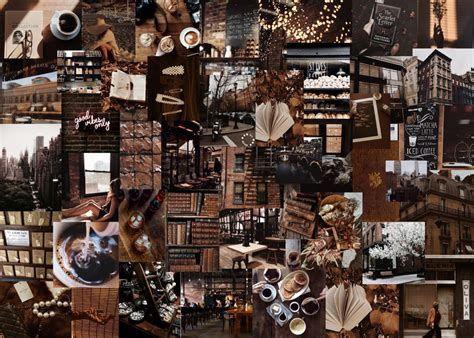
The width and height of the screenshot is (474, 338). What are the coordinates of `photos with books in them` in the screenshot? It's located at (109, 294), (123, 86), (346, 321), (191, 228), (22, 32), (394, 17).